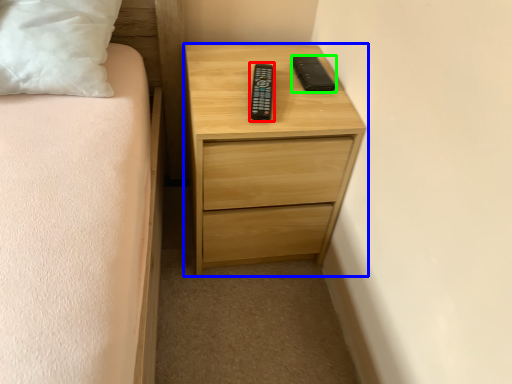
Question: Which is nearer to the control (highlighted by a red box)? chest of drawers (highlighted by a blue box) or gadget (highlighted by a green box).

Choices:
 (A) chest of drawers
 (B) gadget

Answer: (B)